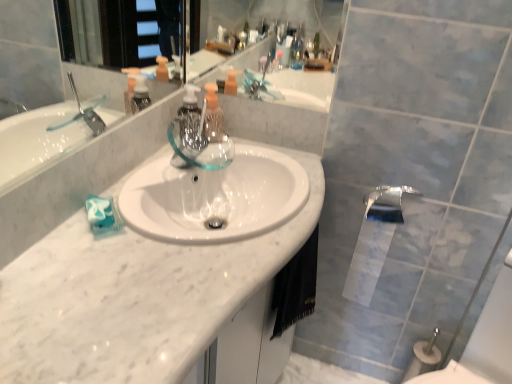
Question: Is black fabric hand towel at lower center next to white marble counter top at center?

Choices:
 (A) yes
 (B) no

Answer: (B)

Question: Is black fabric hand towel at lower center further to camera compared to white marble counter top at center?

Choices:
 (A) no
 (B) yes

Answer: (B)

Question: Is black fabric hand towel at lower center taller than white marble counter top at center?

Choices:
 (A) no
 (B) yes

Answer: (A)

Question: Does black fabric hand towel at lower center have a greater width compared to white marble counter top at center?

Choices:
 (A) yes
 (B) no

Answer: (B)

Question: Is black fabric hand towel at lower center looking in the opposite direction of white marble counter top at center?

Choices:
 (A) yes
 (B) no

Answer: (A)

Question: Does black fabric hand towel at lower center appear on the right side of white marble counter top at center?

Choices:
 (A) yes
 (B) no

Answer: (A)

Question: Is polished chrome tap at lower right positioned far away from black fabric hand towel at lower center?

Choices:
 (A) yes
 (B) no

Answer: (B)

Question: Does polished chrome tap at lower right appear on the right side of black fabric hand towel at lower center?

Choices:
 (A) no
 (B) yes

Answer: (B)

Question: Is polished chrome tap at lower right closer to the viewer compared to black fabric hand towel at lower center?

Choices:
 (A) yes
 (B) no

Answer: (B)

Question: Is the depth of polished chrome tap at lower right greater than that of black fabric hand towel at lower center?

Choices:
 (A) no
 (B) yes

Answer: (B)

Question: Does polished chrome tap at lower right have a lesser height compared to black fabric hand towel at lower center?

Choices:
 (A) yes
 (B) no

Answer: (A)

Question: Is polished chrome tap at lower right aimed at black fabric hand towel at lower center?

Choices:
 (A) no
 (B) yes

Answer: (A)

Question: Is translucent plastic soap dispenser at center located within white glossy toilet paper at lower right?

Choices:
 (A) no
 (B) yes

Answer: (A)